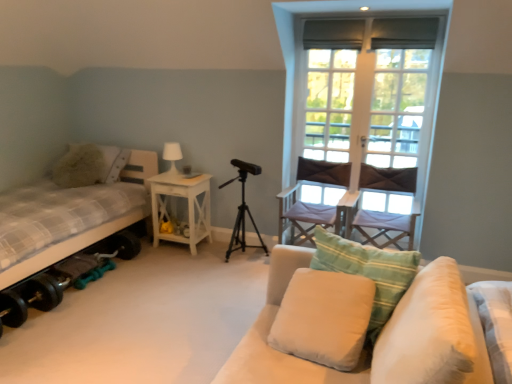
What do you see at coordinates (113, 162) in the screenshot? I see `fluffy beige pillow at left, positioned as the first pillow in back-to-front order` at bounding box center [113, 162].

What do you see at coordinates (242, 222) in the screenshot? I see `black matte tripod at center` at bounding box center [242, 222].

Find the location of `white wood window at upper right`. white wood window at upper right is located at coordinates (298, 39).

Locate an element on the screen. light purple fabric chair at center right, acting as the first chair starting from the right is located at coordinates (382, 226).

Find the location of `white wood screen door at upper right`. white wood screen door at upper right is located at coordinates (397, 107).

Is white wood screen door at upper right surrounded by white wood nightstand at center?

No.

Would you say white wood nightstand at center is to the left or to the right of white wood screen door at upper right in the picture?

white wood nightstand at center is positioned on white wood screen door at upper right's left side.

Is white wood nightstand at center positioned far away from white wood screen door at upper right?

Indeed, white wood nightstand at center is not near white wood screen door at upper right.

Considering the points (204, 235) and (383, 74), which point is in front, point (204, 235) or point (383, 74)?

The point (383, 74) is closer to the camera.

Is light beige fabric pillow at center, acting as the 3th pillow starting from the left, to the left or to the right of white wood window at upper right in the image?

In the image, light beige fabric pillow at center, acting as the 3th pillow starting from the left, appears on the left side of white wood window at upper right.

Is light beige fabric pillow at center, the 2th pillow in the back-to-front sequence, bigger or smaller than white wood window at upper right?

Considering their sizes, light beige fabric pillow at center, the 2th pillow in the back-to-front sequence, takes up more space than white wood window at upper right.

Is white wood window at upper right inside light beige fabric pillow at center, which appears as the 2th pillow when viewed from the right?

No, light beige fabric pillow at center, which appears as the 2th pillow when viewed from the right, does not contain white wood window at upper right.

In terms of height, does light beige fabric pillow at center, which appears as the 2th pillow when viewed from the right, look taller or shorter compared to white wood window at upper right?

light beige fabric pillow at center, which appears as the 2th pillow when viewed from the right, is shorter than white wood window at upper right.

Considering the relative sizes of soft beige fabric couch at lower right and light beige fabric pillow at center, which appears as the 2th pillow when viewed from the right, in the image provided, is soft beige fabric couch at lower right shorter than light beige fabric pillow at center, which appears as the 2th pillow when viewed from the right,?

Incorrect, the height of soft beige fabric couch at lower right does not fall short of that of light beige fabric pillow at center, which appears as the 2th pillow when viewed from the right.

Is soft beige fabric couch at lower right next to light beige fabric pillow at center, the 2th pillow in the back-to-front sequence, and touching it?

No, soft beige fabric couch at lower right is not beside light beige fabric pillow at center, the 2th pillow in the back-to-front sequence.

Is light beige fabric pillow at center, acting as the 3th pillow starting from the left, at the back of soft beige fabric couch at lower right?

No, soft beige fabric couch at lower right is not facing the opposite direction of light beige fabric pillow at center, acting as the 3th pillow starting from the left.

Image resolution: width=512 pixels, height=384 pixels. In the image, there is a light beige fabric pillow at center, the 2th pillow in the back-to-front sequence. In order to click on studio couch below it (from a real-world perspective) in this screenshot , I will do `click(361, 361)`.

Between point (17, 282) and point (345, 313), which one is positioned behind?

The point (17, 282) is more distant.

Are checkered fabric bed at left and white soft cushion at center, arranged as the second pillow when viewed from the front, located far from each other?

Indeed, checkered fabric bed at left is not near white soft cushion at center, arranged as the second pillow when viewed from the front.

Considering the sizes of objects checkered fabric bed at left and white soft cushion at center, which is the second pillow from left to right, in the image provided, who is taller, checkered fabric bed at left or white soft cushion at center, which is the second pillow from left to right,?

checkered fabric bed at left is taller.

From the image's perspective, does checkered fabric bed at left appear lower than white soft cushion at center, which is the second pillow from left to right?

Incorrect, from the image's perspective, checkered fabric bed at left is higher than white soft cushion at center, which is the second pillow from left to right.

Is white soft pillow at lower right, which is the first pillow from front to back, at the back of light beige fabric pillow at center, placed as the third pillow when sorted from front to back?

That's not correct — light beige fabric pillow at center, placed as the third pillow when sorted from front to back, is not looking away from white soft pillow at lower right, which is the first pillow from front to back.

From the image's perspective, is light beige fabric pillow at center, acting as the 3th pillow starting from the left, above white soft pillow at lower right, which ranks as the first pillow in right-to-left order?

Yes.

From a real-world perspective, starting from the white soft pillow at lower right, positioned as the fourth pillow in back-to-front order, which pillow is the 1st one below it? Please provide its 2D coordinates.

[(368, 272)]

From the picture: Does light beige fabric pillow at center, acting as the 3th pillow starting from the left, have a larger size compared to white soft pillow at lower right, positioned as the fourth pillow in back-to-front order?

Actually, light beige fabric pillow at center, acting as the 3th pillow starting from the left, might be smaller than white soft pillow at lower right, positioned as the fourth pillow in back-to-front order.

From a real-world perspective, between black matte tripod at center and checkered fabric bed at left, who is vertically lower?

black matte tripod at center.

Considering the relative positions of black matte tripod at center and checkered fabric bed at left in the image provided, is black matte tripod at center to the left or to the right of checkered fabric bed at left?

black matte tripod at center is positioned on checkered fabric bed at left's right side.

From the image's perspective, is black matte tripod at center located above or below checkered fabric bed at left?

From the image's perspective, black matte tripod at center appears below checkered fabric bed at left.

Identify the location of tripod beneath the checkered fabric bed at left (from a real-world perspective). (242, 222).

Which of these two, light purple fabric chair at center right, which is the second chair from left to right, or black matte tripod at center, is bigger?

light purple fabric chair at center right, which is the second chair from left to right, is bigger.

Which is closer to the camera, (398, 192) or (243, 182)?

Positioned in front is point (398, 192).

Which of these two, light purple fabric chair at center right, which is the second chair from left to right, or black matte tripod at center, stands taller?

Standing taller between the two is black matte tripod at center.

Considering the relative positions of light purple fabric chair at center right, acting as the first chair starting from the right, and black matte tripod at center in the image provided, is light purple fabric chair at center right, acting as the first chair starting from the right, to the left of black matte tripod at center from the viewer's perspective?

No.

Where is `screen door in front of the white wood nightstand at center`? The height and width of the screenshot is (384, 512). screen door in front of the white wood nightstand at center is located at coordinates (397, 107).

In the image, there is a light beige fabric pillow at center, the 2th pillow in the back-to-front sequence. Identify the location of window above it (from the image's perspective). Image resolution: width=512 pixels, height=384 pixels. (298, 39).

When comparing their distances from light beige fabric pillow at center, placed as the third pillow when sorted from front to back, does dark brown fabric chair at center, which appears as the 2th chair when viewed from the right, or black matte tripod at center seem closer?

dark brown fabric chair at center, which appears as the 2th chair when viewed from the right, is positioned closer to the anchor light beige fabric pillow at center, placed as the third pillow when sorted from front to back.

Which object lies further to the anchor point soft beige fabric couch at lower right, white soft cushion at center, which is the second pillow from left to right, or black matte tripod at center?

Among the two, black matte tripod at center is located further to soft beige fabric couch at lower right.

Looking at the image, which one is located closer to light purple fabric chair at center right, acting as the first chair starting from the right, soft beige fabric couch at lower right or white wood nightstand at center?

white wood nightstand at center is positioned closer to the anchor light purple fabric chair at center right, acting as the first chair starting from the right.

Considering their positions, is white matte table lamp at upper center positioned closer to black matte tripod at center than white wood screen door at upper right?

white matte table lamp at upper center is positioned closer to the anchor black matte tripod at center.

Based on their spatial positions, is dark brown fabric chair at center, the first chair positioned from the left, or light beige fabric pillow at center, placed as the third pillow when sorted from front to back, further from light purple fabric chair at center right, acting as the first chair starting from the right?

light beige fabric pillow at center, placed as the third pillow when sorted from front to back.

From the picture: Looking at the image, which one is located further to white wood window at upper right, white wood nightstand at center or white wood screen door at upper right?

white wood nightstand at center lies further to white wood window at upper right than the other object.

Based on their spatial positions, is soft beige fabric couch at lower right or white wood window at upper right closer to black matte tripod at center?

The object closer to black matte tripod at center is white wood window at upper right.

When comparing their distances from white soft cushion at center, the third pillow viewed from the back, does white matte table lamp at upper center or fluffy beige pillow at left, positioned as the first pillow in back-to-front order, seem closer?

white matte table lamp at upper center is closer to white soft cushion at center, the third pillow viewed from the back.

This screenshot has width=512, height=384. What are the coordinates of `chair located between black matte tripod at center and white wood window at upper right in the left-right direction` in the screenshot? It's located at (312, 203).

Find the location of a particular element. window between light beige fabric pillow at center, acting as the 3th pillow starting from the left, and black matte tripod at center in the front-back direction is located at coordinates (298, 39).

Locate an element on the screen. The image size is (512, 384). tripod situated between white matte table lamp at upper center and white wood window at upper right from left to right is located at coordinates (242, 222).

Locate an element on the screen. table lamp situated between checkered fabric bed at left and light purple fabric chair at center right, which is the second chair from left to right, from left to right is located at coordinates (172, 156).